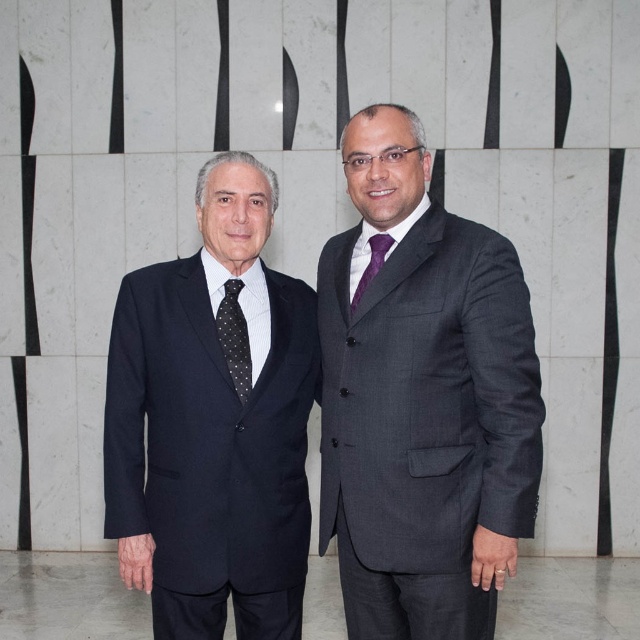
Is point (228, 474) more distant than point (452, 467)?

Yes, it is behind point (452, 467).

Which is below, matte black suit at left or gray textured suit at right?

Positioned lower is gray textured suit at right.

Describe the element at coordinates (212, 424) in the screenshot. I see `matte black suit at left` at that location.

Where is `matte black suit at left`? The height and width of the screenshot is (640, 640). matte black suit at left is located at coordinates (212, 424).

Between matte black suit at left and purple satin tie at center, which one is positioned lower?

matte black suit at left is lower down.

Is point (244, 556) farther from camera compared to point (388, 243)?

No.

Identify the location of matte black suit at left. (212, 424).

Is dark gray suit at center positioned in front of matte black suit at left?

Yes, dark gray suit at center is in front of matte black suit at left.

Is point (397, 621) behind point (145, 280)?

Yes, point (397, 621) is behind point (145, 280).

The height and width of the screenshot is (640, 640). Find the location of `dark gray suit at center`. dark gray suit at center is located at coordinates (422, 400).